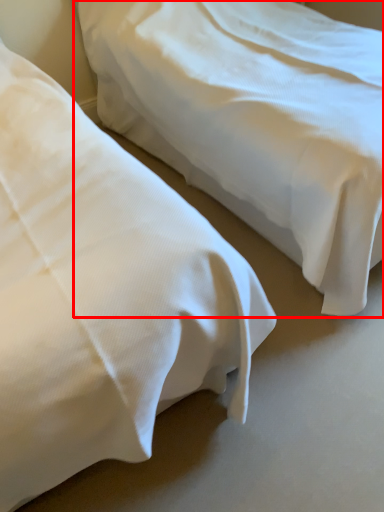
Question: From the image's perspective, what is the correct spatial relationship of bed (annotated by the red box) in relation to bed?

Choices:
 (A) below
 (B) above

Answer: (B)